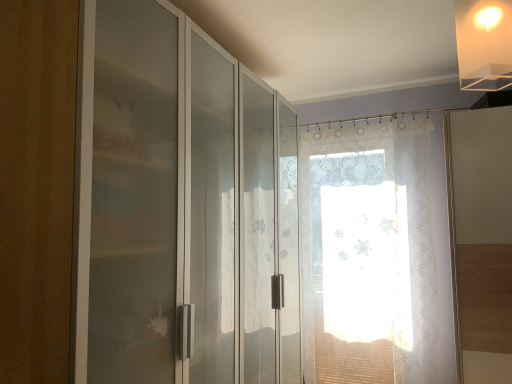
Question: Can you confirm if translucent floral curtain at center is taller than translucent acrylic lampshade at upper right?

Choices:
 (A) yes
 (B) no

Answer: (A)

Question: From a real-world perspective, is translucent floral curtain at center on translucent acrylic lampshade at upper right?

Choices:
 (A) no
 (B) yes

Answer: (A)

Question: Is translucent floral curtain at center behind translucent acrylic lampshade at upper right?

Choices:
 (A) no
 (B) yes

Answer: (B)

Question: Is translucent floral curtain at center turned away from translucent acrylic lampshade at upper right?

Choices:
 (A) no
 (B) yes

Answer: (A)

Question: Does translucent floral curtain at center appear on the left side of translucent acrylic lampshade at upper right?

Choices:
 (A) no
 (B) yes

Answer: (A)

Question: Considering the relative sizes of translucent floral curtain at center and translucent acrylic lampshade at upper right in the image provided, is translucent floral curtain at center smaller than translucent acrylic lampshade at upper right?

Choices:
 (A) no
 (B) yes

Answer: (A)

Question: Does frosted glass cabinet at left lie behind translucent floral curtain at center?

Choices:
 (A) yes
 (B) no

Answer: (B)

Question: Can you confirm if frosted glass cabinet at left is smaller than translucent floral curtain at center?

Choices:
 (A) yes
 (B) no

Answer: (B)

Question: Is frosted glass cabinet at left taller than translucent floral curtain at center?

Choices:
 (A) yes
 (B) no

Answer: (B)

Question: Is frosted glass cabinet at left positioned beyond the bounds of translucent floral curtain at center?

Choices:
 (A) yes
 (B) no

Answer: (A)

Question: Is the position of frosted glass cabinet at left less distant than that of translucent floral curtain at center?

Choices:
 (A) yes
 (B) no

Answer: (A)

Question: Can you confirm if frosted glass cabinet at left is wider than translucent floral curtain at center?

Choices:
 (A) yes
 (B) no

Answer: (A)

Question: Considering the relative positions of translucent floral curtain at center and frosted glass cabinet at left in the image provided, is translucent floral curtain at center to the right of frosted glass cabinet at left from the viewer's perspective?

Choices:
 (A) yes
 (B) no

Answer: (A)